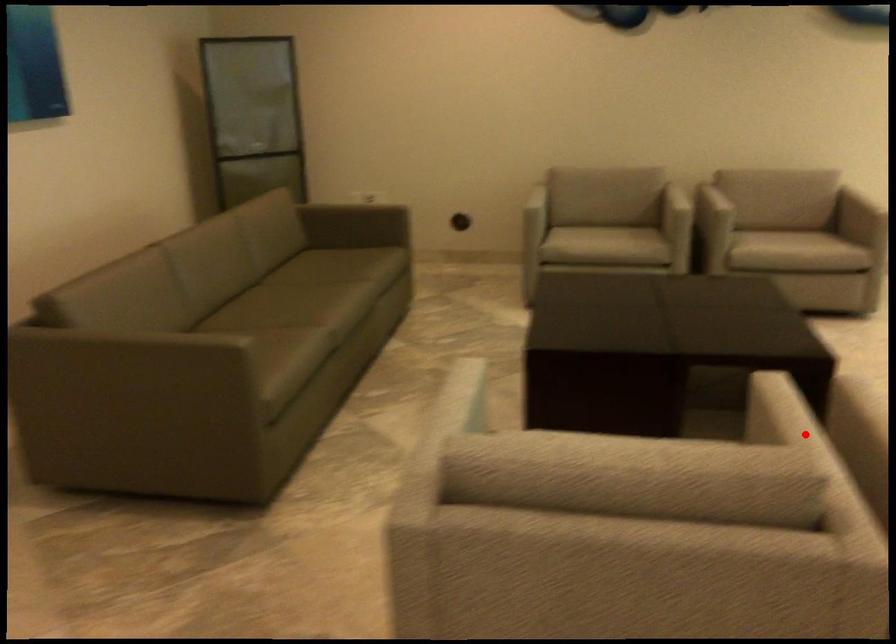
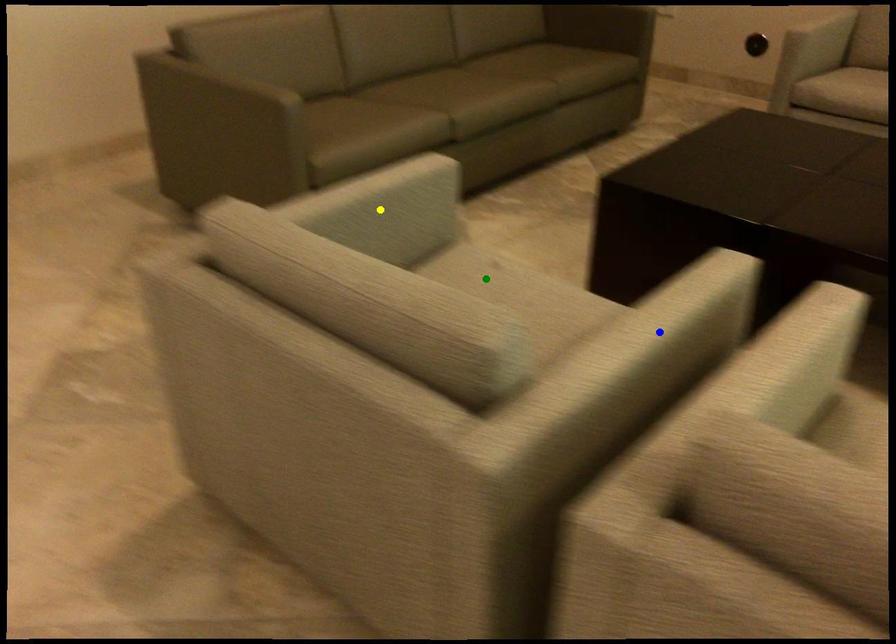
Question: I am providing you with two images of the same scene from different viewpoints. A red point is marked on the first image. You are given multiple points on the second image. Which point in image 2 represents the same 3d spot as the red point in image 1?

Choices:
 (A) yellow point
 (B) green point
 (C) blue point

Answer: (C)